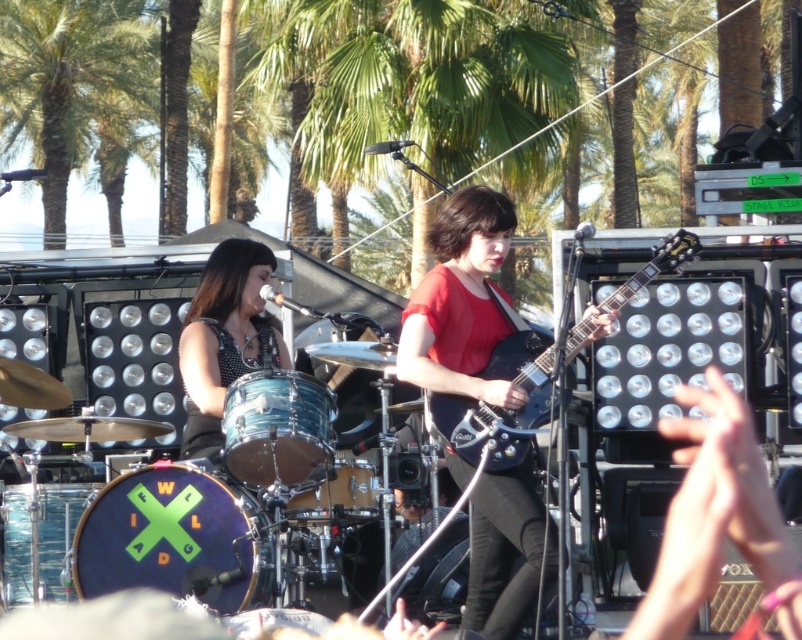
Question: Is blue metallic drum at center above brushed metal drum at lower left?

Choices:
 (A) yes
 (B) no

Answer: (A)

Question: Considering the real-world distances, which object is farthest from the blue metallic drum at center?

Choices:
 (A) wooden drum at center
 (B) brushed metal drum at lower left

Answer: (B)

Question: Which of the following is the farthest from the observer?

Choices:
 (A) click(x=245, y=416)
 (B) click(x=464, y=326)
 (C) click(x=223, y=266)

Answer: (C)

Question: Among these points, which one is farthest from the camera?

Choices:
 (A) click(x=687, y=250)
 (B) click(x=484, y=259)
 (C) click(x=189, y=579)

Answer: (B)

Question: Does matte black guitar at center appear over blue drumhead at center?

Choices:
 (A) no
 (B) yes

Answer: (A)

Question: Can you confirm if blue drumhead at center is positioned to the left of wooden drum at center?

Choices:
 (A) no
 (B) yes

Answer: (B)